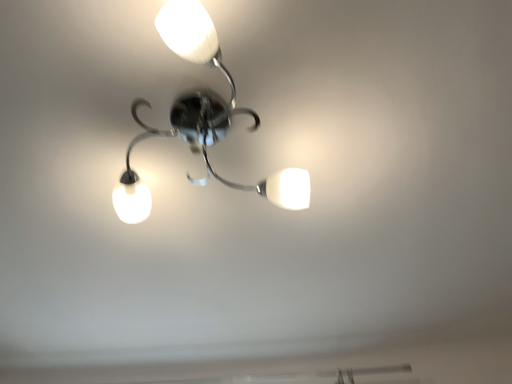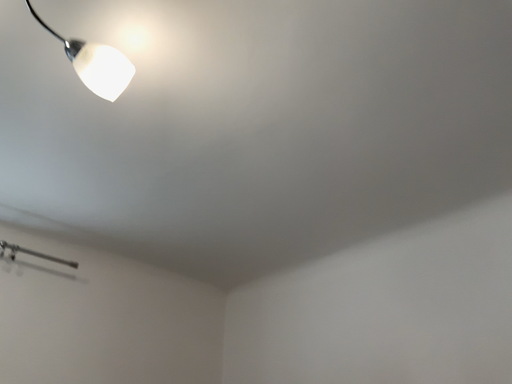
Question: Which way did the camera rotate in the video?

Choices:
 (A) rotated right
 (B) rotated left

Answer: (A)